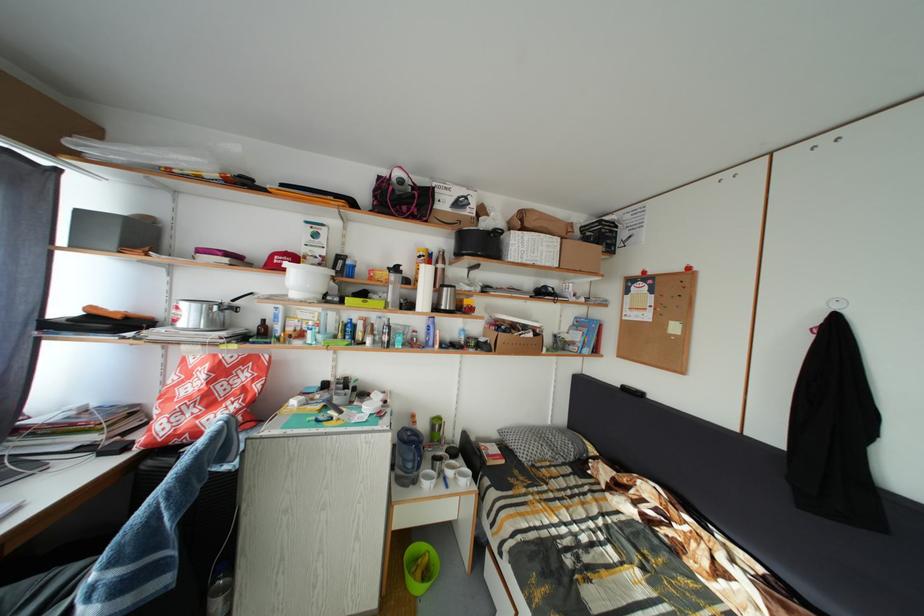
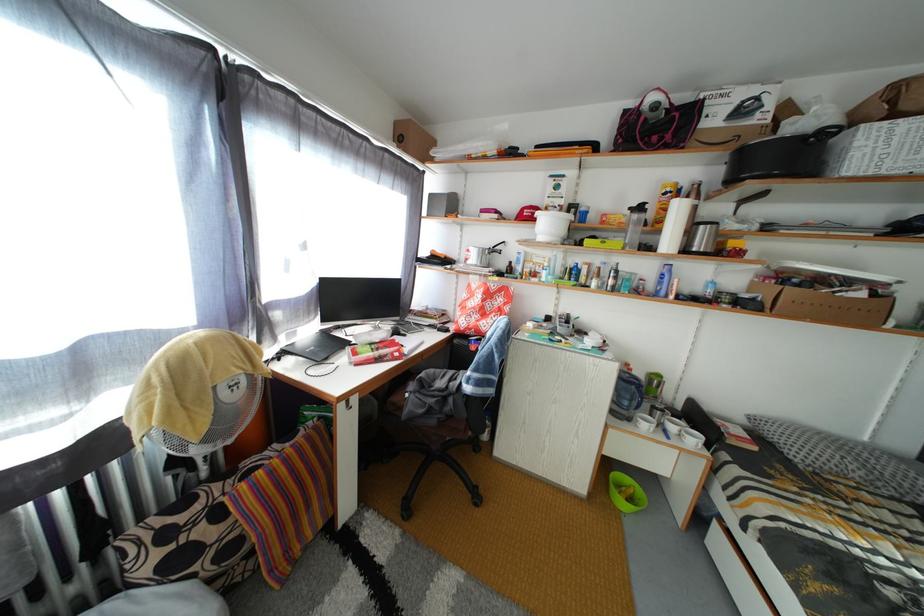
Question: How did the camera likely rotate?

Choices:
 (A) Left
 (B) Right
 (C) Up
 (D) Down

Answer: (A)